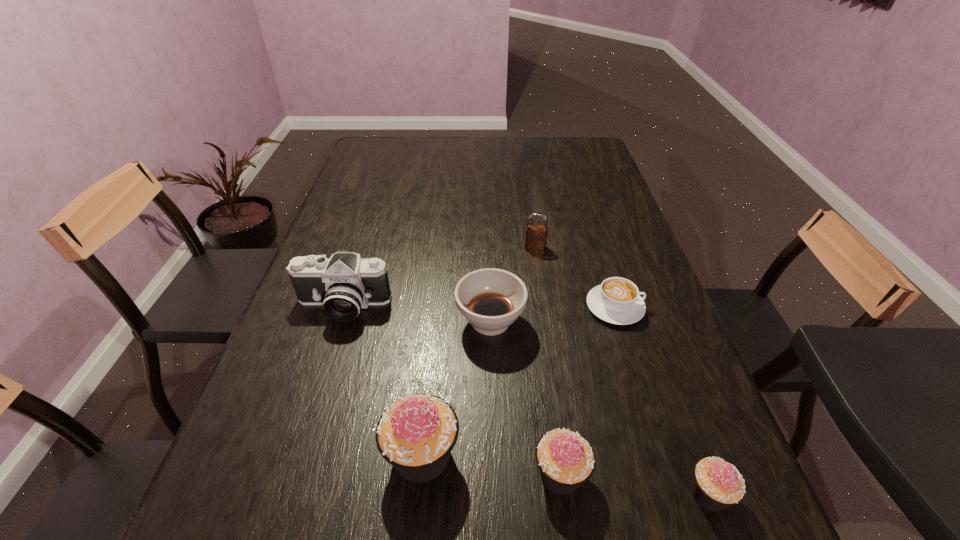
Locate an element on the screen. This screenshot has height=540, width=960. the tallest cupcake is located at coordinates (416, 434).

Locate an element on the screen. the tallest object is located at coordinates (416, 434).

At what (x,y) coordinates should I click in order to perform the action: click on the second cupcake from left to right. Please return your answer as a coordinate pair (x, y). Looking at the image, I should click on (566, 460).

Where is `the rightmost cupcake`? the rightmost cupcake is located at coordinates (717, 484).

Where is `camera`? This screenshot has height=540, width=960. camera is located at coordinates (344, 284).

Find the location of a particular element. The width and height of the screenshot is (960, 540). the farthest object is located at coordinates (536, 235).

Identify the location of cappuccino. (617, 300).

The width and height of the screenshot is (960, 540). Identify the location of soup bowl. (490, 299).

At what (x,y) coordinates should I click in order to perform the action: click on vacant region located 0.220m on the right of the tallest cupcake. Please return your answer as a coordinate pair (x, y). The height and width of the screenshot is (540, 960). Looking at the image, I should click on (582, 455).

Locate an element on the screen. vacant space located 0.190m on the back of the second shortest cupcake is located at coordinates (545, 363).